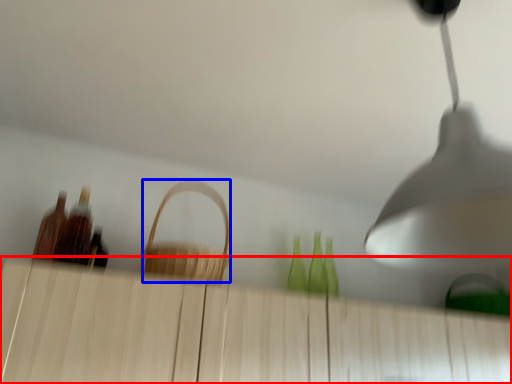
Question: Among these objects, which one is nearest to the camera, dresser (highlighted by a red box) or basket (highlighted by a blue box)?

Choices:
 (A) dresser
 (B) basket

Answer: (A)